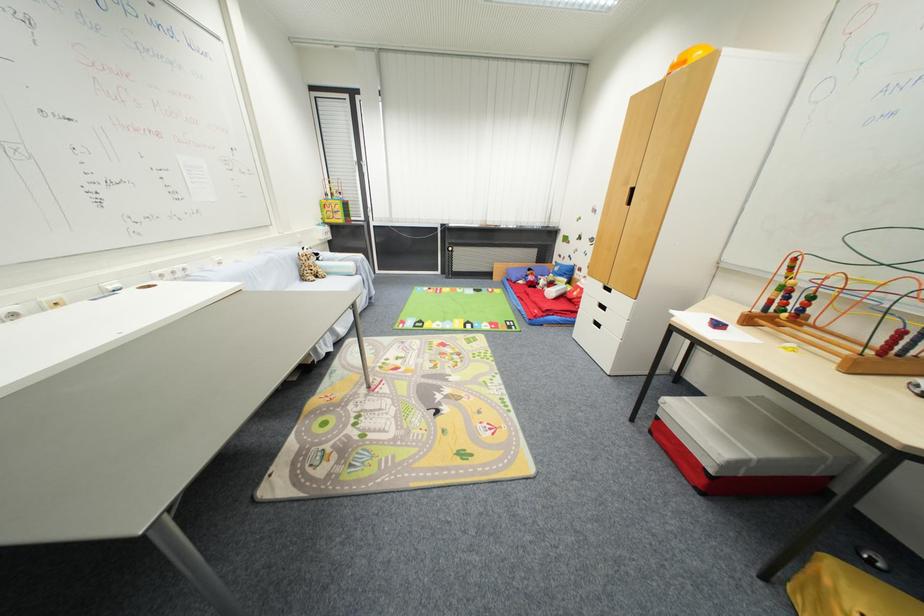
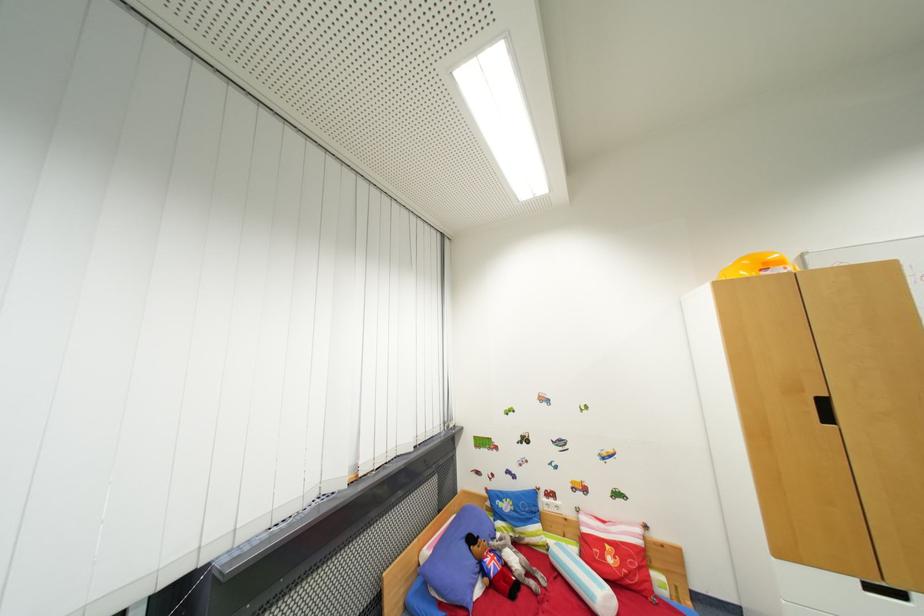
The point at (582, 276) is marked in the first image. Where is the corresponding point in the second image?

(550, 506)